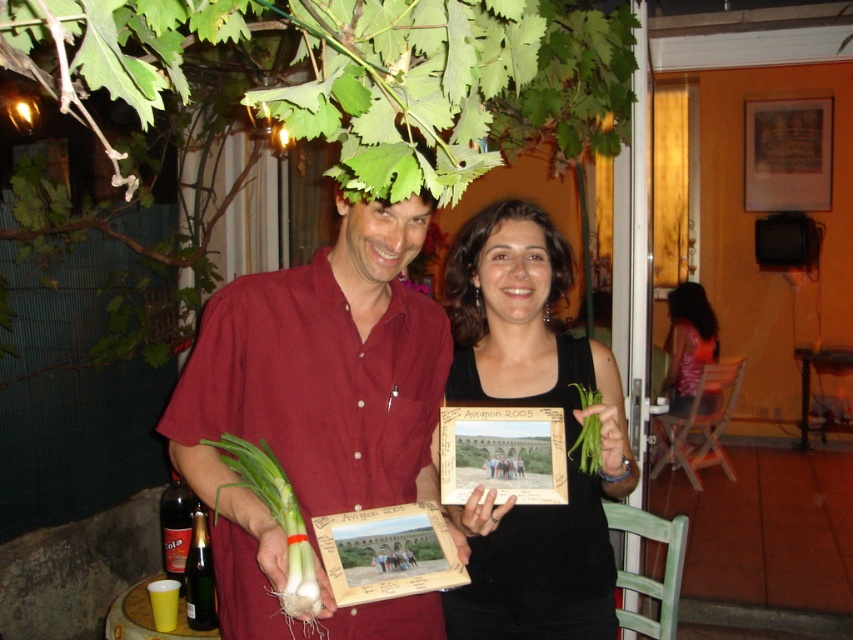
You are a tailor measuring fabric lengths. You have a piece of fabric that is exactly the same width as the wooden picture frame at upper right. Can you use this fabric to cover the matte red shirt at center without any adjustments?

The matte red shirt at center is narrower than the wooden picture frame at upper right. Since the fabric matches the frame width, it will be wider than needed for the shirt. Therefore, you can cover the matte red shirt at center with the fabric without any adjustments, as the fabric is wider than the shirt.

You are standing at the entrance of the patio and want to place a small potted plant exactly at the point marked as point (352,76). Which object in the scene is currently occupying that location?

The green leafy plant at upper center is located at point (352,76), so it is currently occupying that location.

You are a photographer trying to capture the green matte leek at center and the matte wooden frame at center in the same shot. Which object is closer to the camera, and why?

The green matte leek at center is closer to the camera because it is positioned under the matte wooden frame at center, meaning it is in front of the frame.